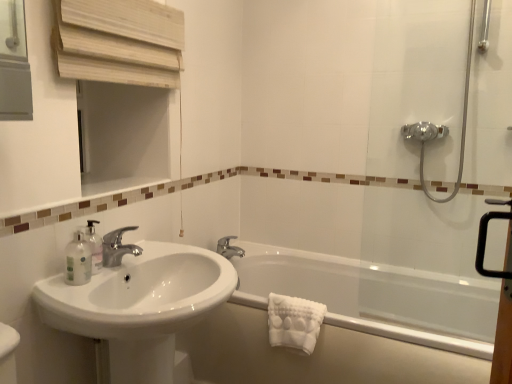
Question: From the image's perspective, does transparent glass shower door at right appear higher than silver metallic faucet at upper center, which appears as the 2th tap when viewed from the left?

Choices:
 (A) no
 (B) yes

Answer: (B)

Question: Does transparent glass shower door at right have a smaller size compared to silver metallic faucet at upper center, which is the 1th tap in right-to-left order?

Choices:
 (A) no
 (B) yes

Answer: (A)

Question: Is transparent glass shower door at right thinner than silver metallic faucet at upper center, which appears as the 2th tap when viewed from the left?

Choices:
 (A) no
 (B) yes

Answer: (A)

Question: From a real-world perspective, is transparent glass shower door at right on top of silver metallic faucet at upper center, which is counted as the 2th tap, starting from the front?

Choices:
 (A) no
 (B) yes

Answer: (B)

Question: Can you confirm if transparent glass shower door at right is positioned to the right of silver metallic faucet at upper center, which is counted as the 2th tap, starting from the front?

Choices:
 (A) yes
 (B) no

Answer: (A)

Question: Does transparent glass shower door at right have a greater width compared to silver metallic faucet at upper center, which is the 1th tap in right-to-left order?

Choices:
 (A) no
 (B) yes

Answer: (B)

Question: Can you confirm if silver metallic faucet at upper center, which appears as the 2th tap when viewed from the left, is positioned to the left of white glossy bathtub at lower right?

Choices:
 (A) no
 (B) yes

Answer: (B)

Question: From a real-world perspective, is silver metallic faucet at upper center, which is the 1th tap in right-to-left order, physically above white glossy bathtub at lower right?

Choices:
 (A) yes
 (B) no

Answer: (A)

Question: Is silver metallic faucet at upper center, which is counted as the 2th tap, starting from the front, smaller than white glossy bathtub at lower right?

Choices:
 (A) no
 (B) yes

Answer: (B)

Question: Is silver metallic faucet at upper center, placed as the 1th tap when sorted from back to front, wider than white glossy bathtub at lower right?

Choices:
 (A) no
 (B) yes

Answer: (A)

Question: Does silver metallic faucet at upper center, which appears as the 2th tap when viewed from the left, have a lesser height compared to white glossy bathtub at lower right?

Choices:
 (A) no
 (B) yes

Answer: (B)

Question: From the image's perspective, is silver metallic faucet at upper center, which is the 1th tap in right-to-left order, over white glossy bathtub at lower right?

Choices:
 (A) yes
 (B) no

Answer: (A)

Question: Is silver metallic faucet at upper center, which is counted as the 2th tap, starting from the front, positioned behind transparent glass shower door at right?

Choices:
 (A) no
 (B) yes

Answer: (B)